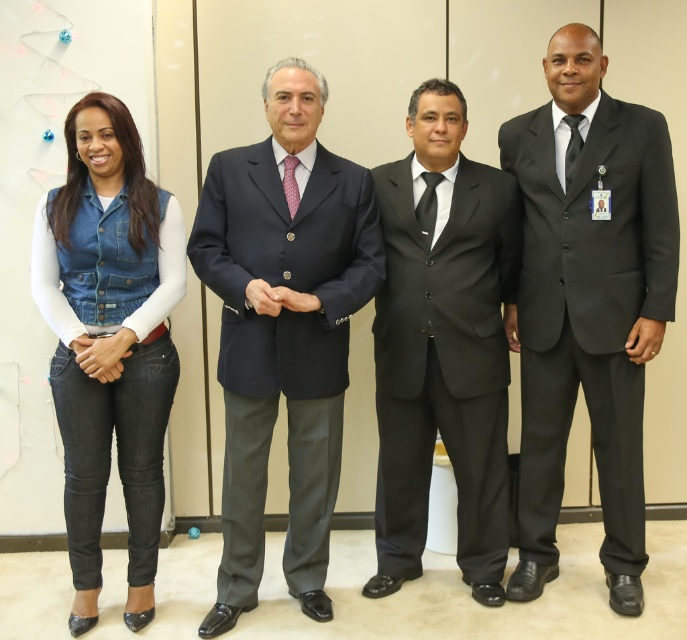
Question: Which of the following is the farthest from the observer?

Choices:
 (A) black satin suit at center
 (B) navy blue suit at center
 (C) black satin tie at center
 (D) denim vest at left

Answer: (C)

Question: In this image, where is denim vest at left located relative to black satin tie at center?

Choices:
 (A) right
 (B) left

Answer: (B)

Question: Does black satin suit at right have a lesser width compared to black satin tie at right?

Choices:
 (A) no
 (B) yes

Answer: (A)

Question: Does navy blue suit at center have a lesser width compared to black satin suit at center?

Choices:
 (A) no
 (B) yes

Answer: (A)

Question: Which of the following is the farthest from the observer?

Choices:
 (A) black satin tie at right
 (B) pink dotted tie at center

Answer: (A)

Question: Which of these objects is positioned closest to the navy blue suit at center?

Choices:
 (A) denim vest at left
 (B) pink dotted tie at center

Answer: (A)